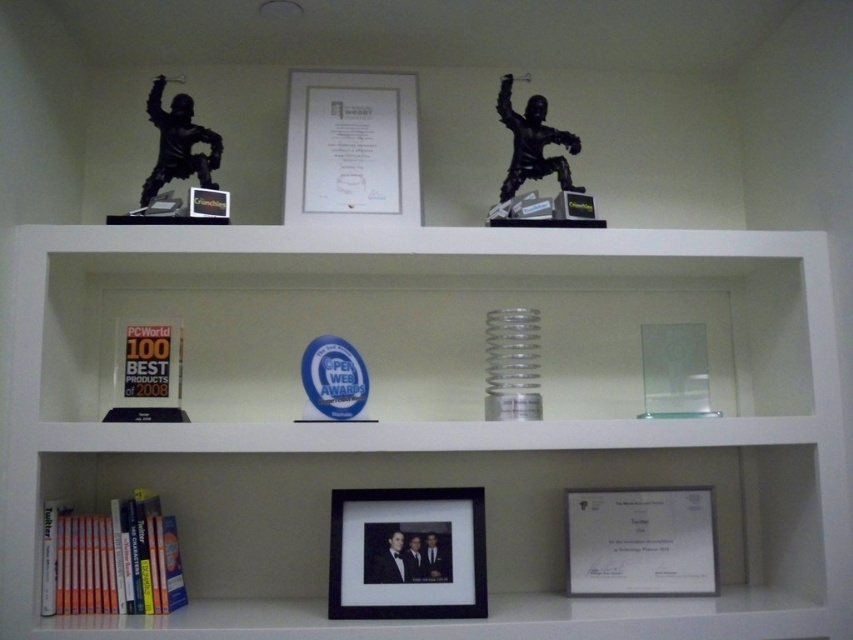
Which is behind, point (242, 520) or point (215, 188)?

The point (242, 520) is more distant.

Does white plastic shelf at upper center have a greater height compared to black matte statue at upper left?

Indeed, white plastic shelf at upper center has a greater height compared to black matte statue at upper left.

Identify the location of white plastic shelf at upper center. Image resolution: width=853 pixels, height=640 pixels. (433, 417).

Between point (469, 550) and point (180, 580), which one is positioned in front?

Positioned in front is point (180, 580).

Is black matte picture frame at center wider than hardcover books at lower left?

Correct, the width of black matte picture frame at center exceeds that of hardcover books at lower left.

The height and width of the screenshot is (640, 853). In order to click on black matte picture frame at center in this screenshot , I will do `click(407, 554)`.

Who is more forward, (664,548) or (189,161)?

Point (189,161) is in front.

Looking at this image, between white paper certificate at lower center and black matte statue at upper left, which one is positioned higher?

black matte statue at upper left is above.

The width and height of the screenshot is (853, 640). I want to click on white paper certificate at lower center, so click(640, 541).